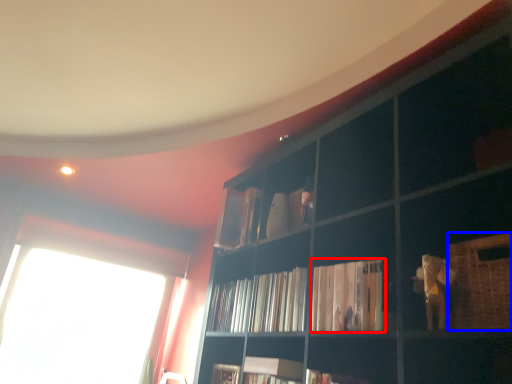
Question: Which of the following is the closest to the observer, book (highlighted by a red box) or basket (highlighted by a blue box)?

Choices:
 (A) book
 (B) basket

Answer: (B)